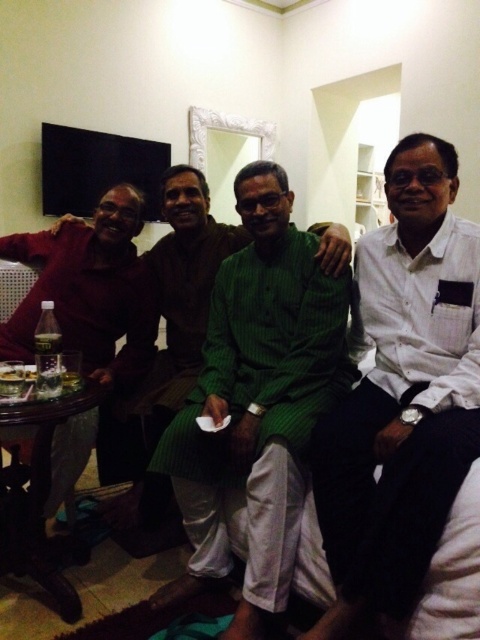
Measure the distance between white cotton shirt at right and camera.

white cotton shirt at right and camera are 1.28 meters apart.

Find the location of a particular element. white cotton shirt at right is located at coordinates pyautogui.click(x=402, y=394).